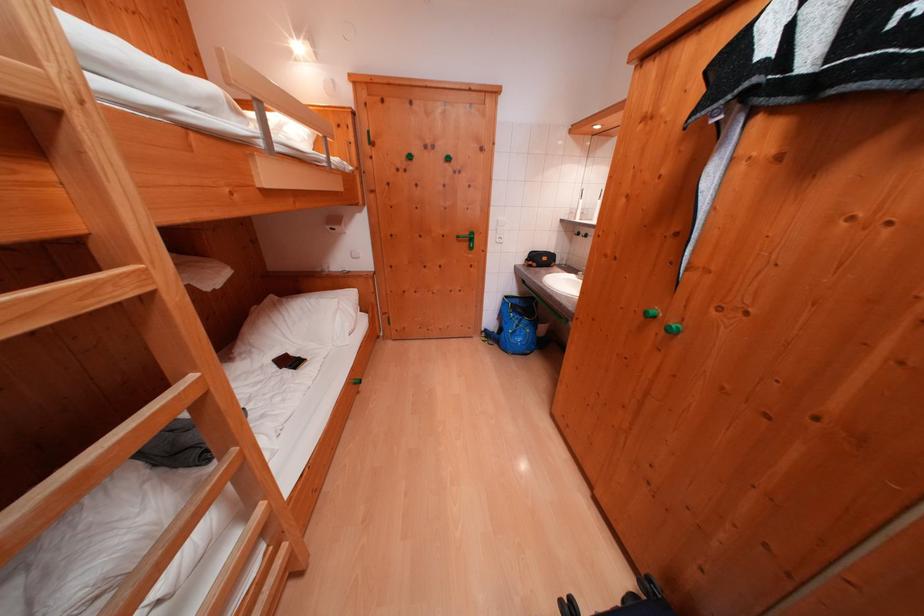
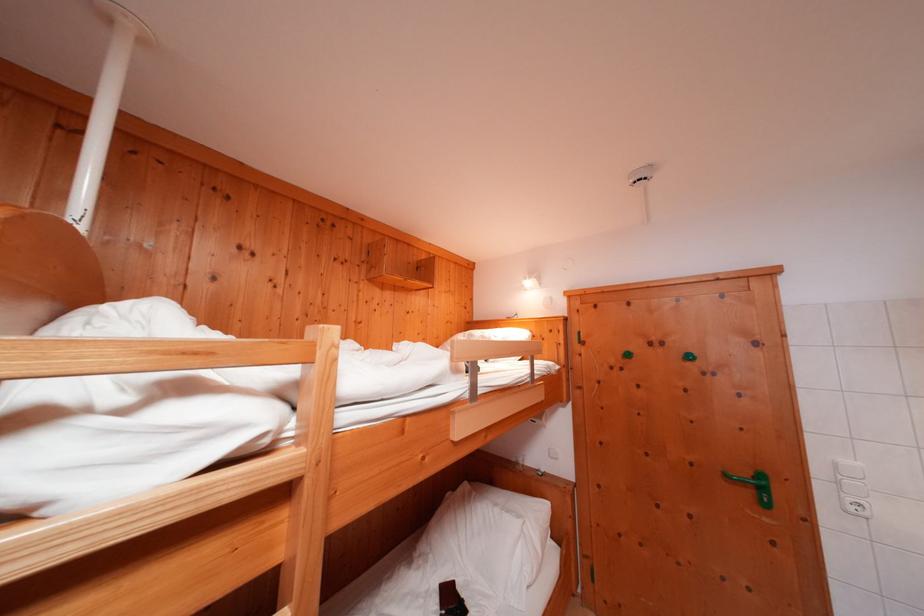
Where in the second image is the point corresponding to point (480, 244) from the first image?

(771, 493)